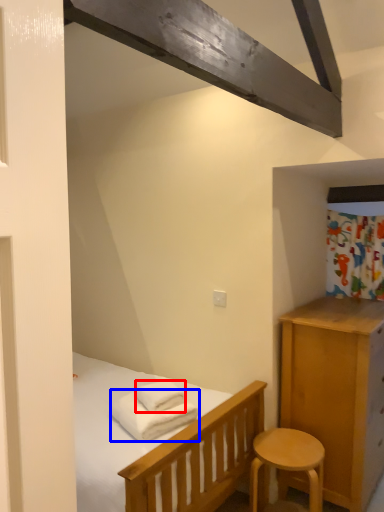
Question: Which point is further to the camera, bath towel (highlighted by a red box) or bath towel (highlighted by a blue box)?

Choices:
 (A) bath towel
 (B) bath towel

Answer: (A)